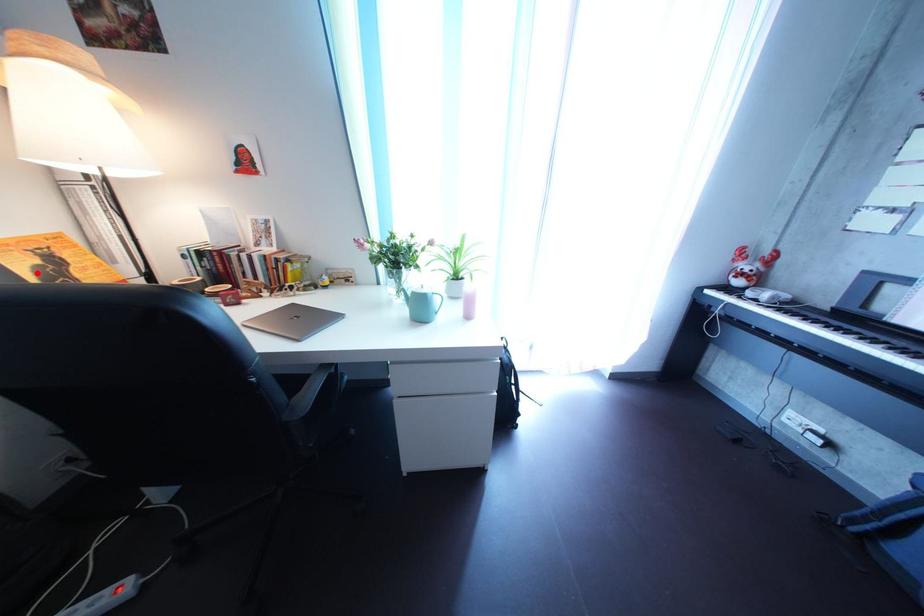
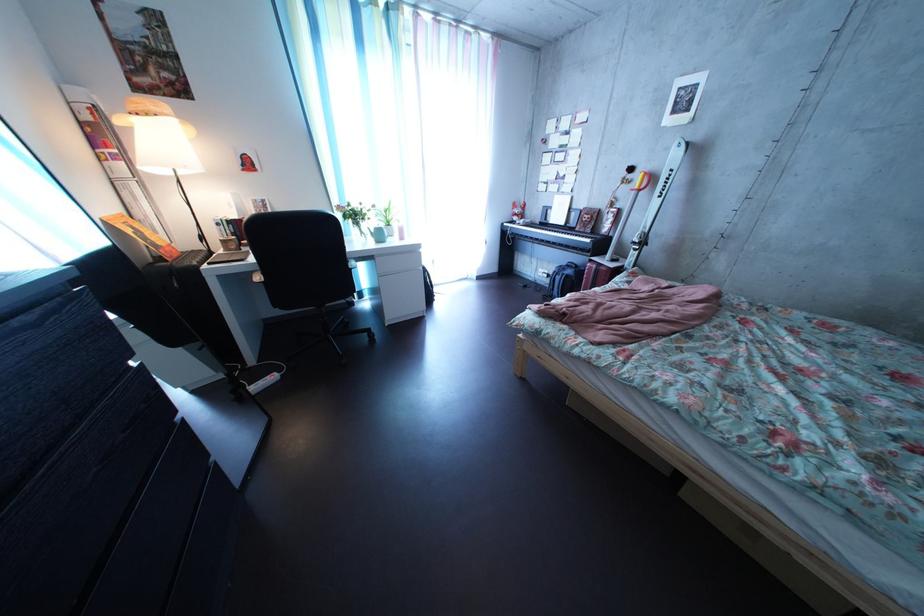
Question: I am providing you with two images of the same scene from different viewpoints. Given a red point in image1, look at the same physical point in image2. Is it:

Choices:
 (A) Closer to the viewpoint
 (B) Farther from the viewpoint

Answer: (A)